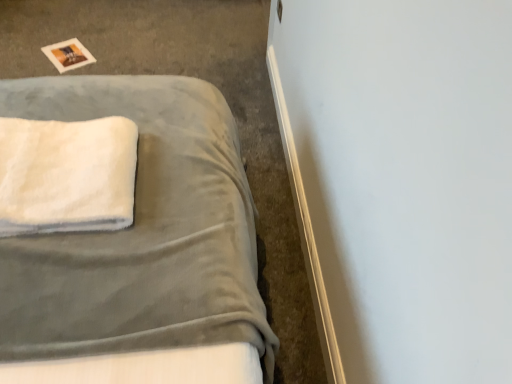
You are a GUI agent. You are given a task and a screenshot of the screen. Output one action in this format:
    pyautogui.click(x=<x>, y=<y>)
    Task: Click on the free space above suede gray bed at upper left (from a real-world perspective)
    The image size is (512, 384).
    Given the screenshot: What is the action you would take?
    pyautogui.click(x=153, y=52)